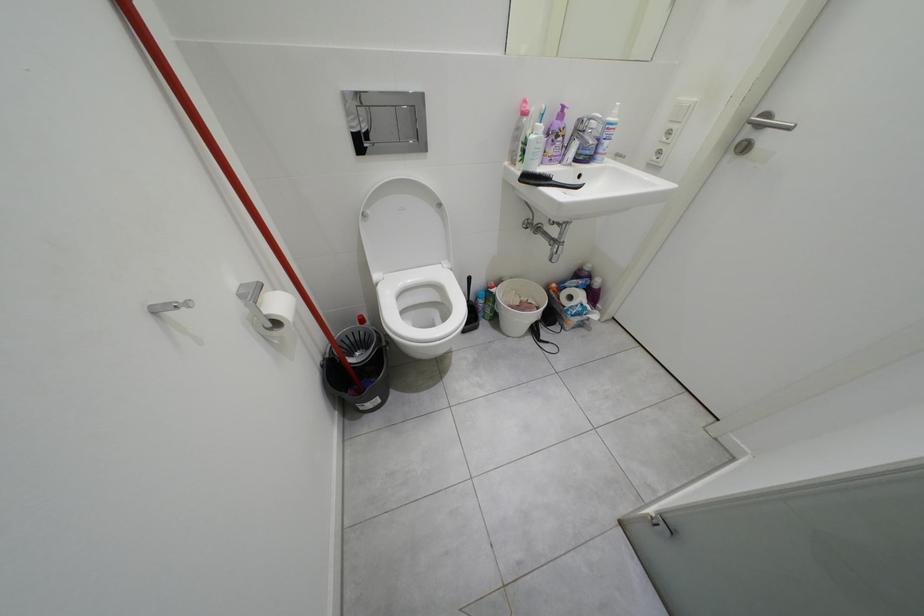
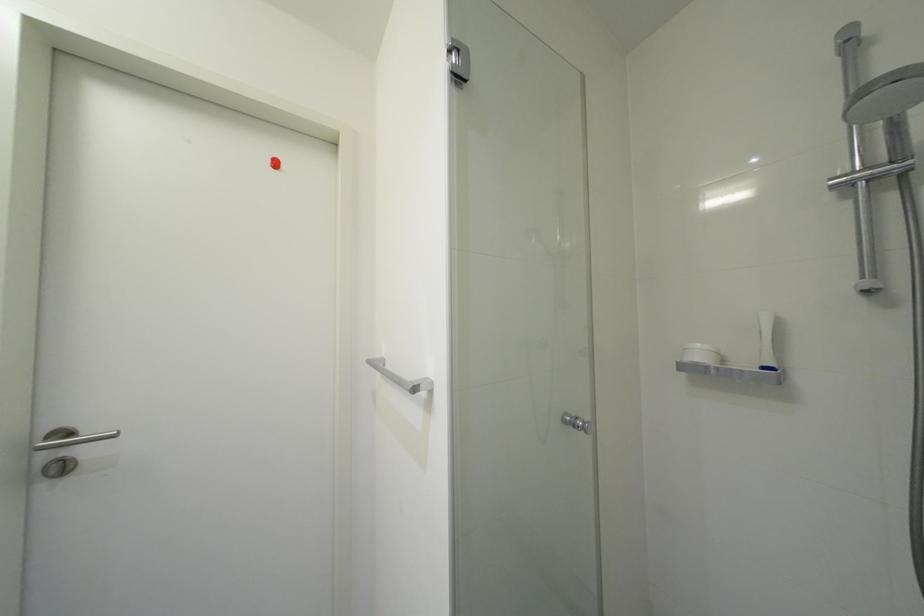
Question: The camera is either moving clockwise (left) or counter-clockwise (right) around the object. The first image is from the beginning of the video and the second image is from the end. Is the camera moving left or right when shooting the video?

Choices:
 (A) Left
 (B) Right

Answer: (A)